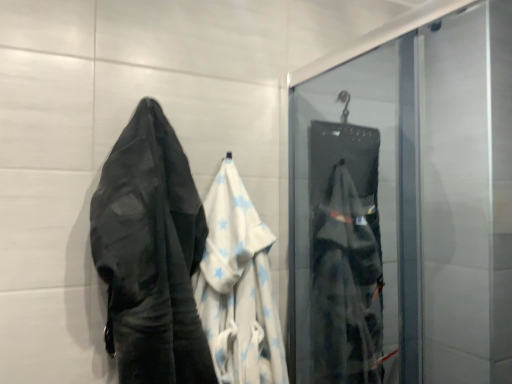
Question: Is white cotton towel at center bigger or smaller than white cotton towel at left?

Choices:
 (A) small
 (B) big

Answer: (A)

Question: Does point pos(225,165) appear closer or farther from the camera than point pos(141,180)?

Choices:
 (A) farther
 (B) closer

Answer: (A)

Question: Which object is positioned farthest from the matte black bag at right?

Choices:
 (A) white cotton towel at center
 (B) white cotton towel at left

Answer: (B)

Question: Which is farther from the white cotton towel at center?

Choices:
 (A) matte black bag at right
 (B) white cotton towel at left

Answer: (A)